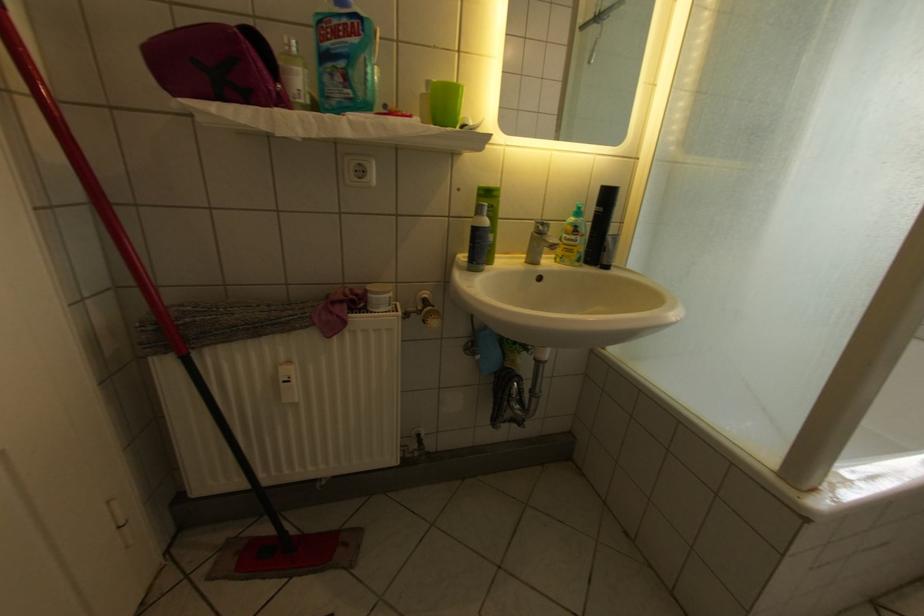
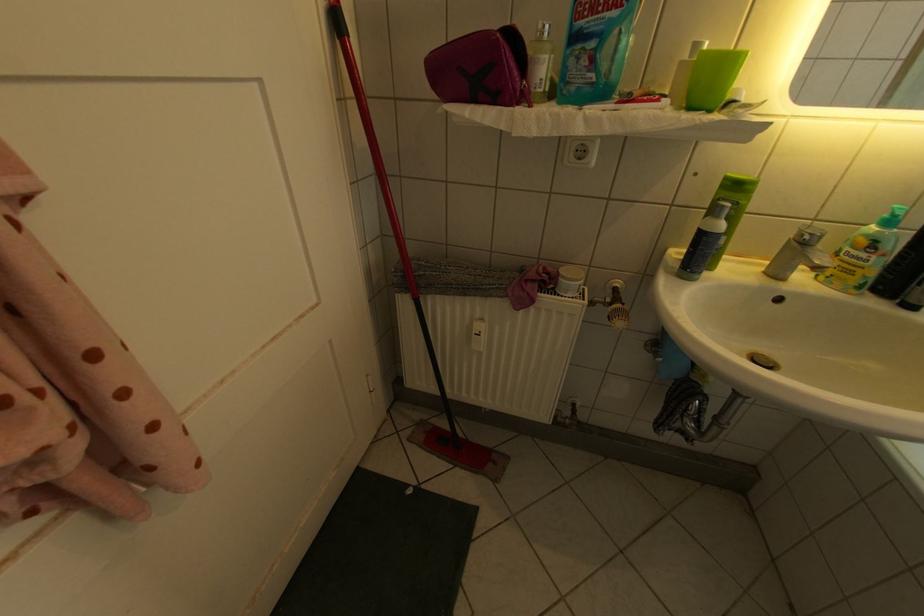
In the second image, find the point that corresponds to the point at 441,321 in the first image.

(626, 320)